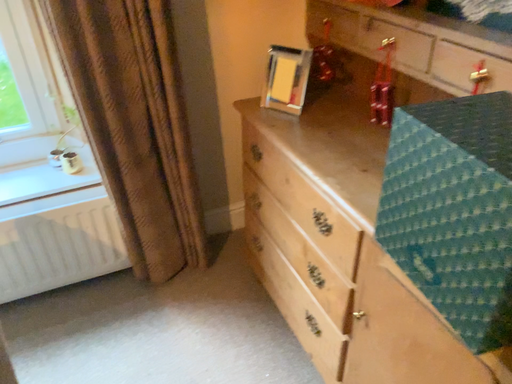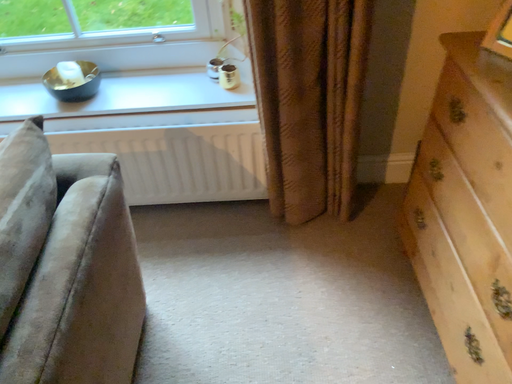
Question: How did the camera likely rotate when shooting the video?

Choices:
 (A) rotated downward
 (B) rotated upward

Answer: (A)